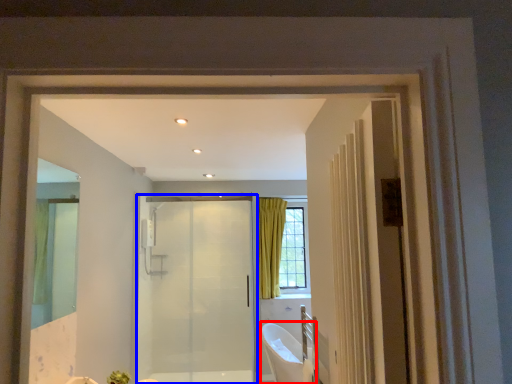
Question: Among these objects, which one is nearest to the camera, bath (highlighted by a red box) or door (highlighted by a blue box)?

Choices:
 (A) bath
 (B) door

Answer: (A)